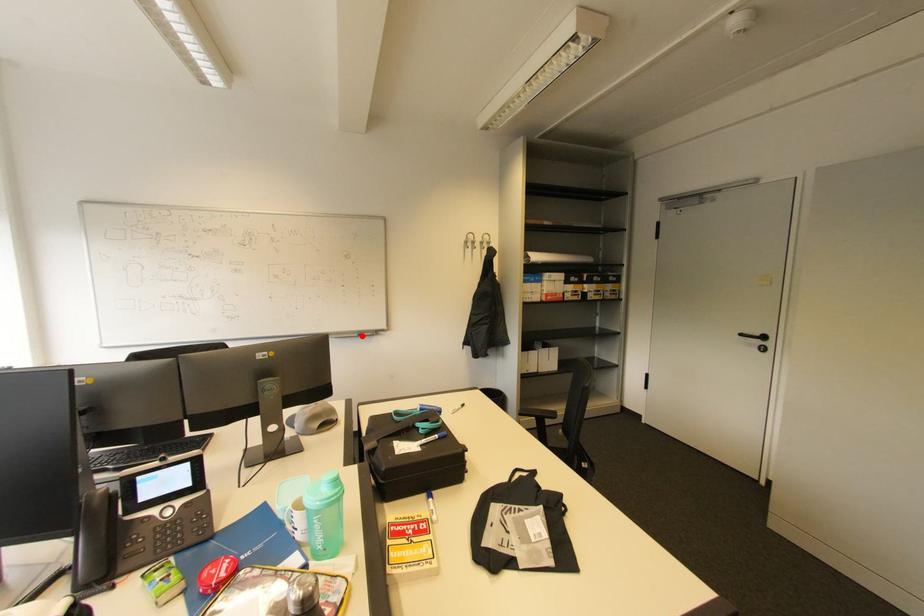
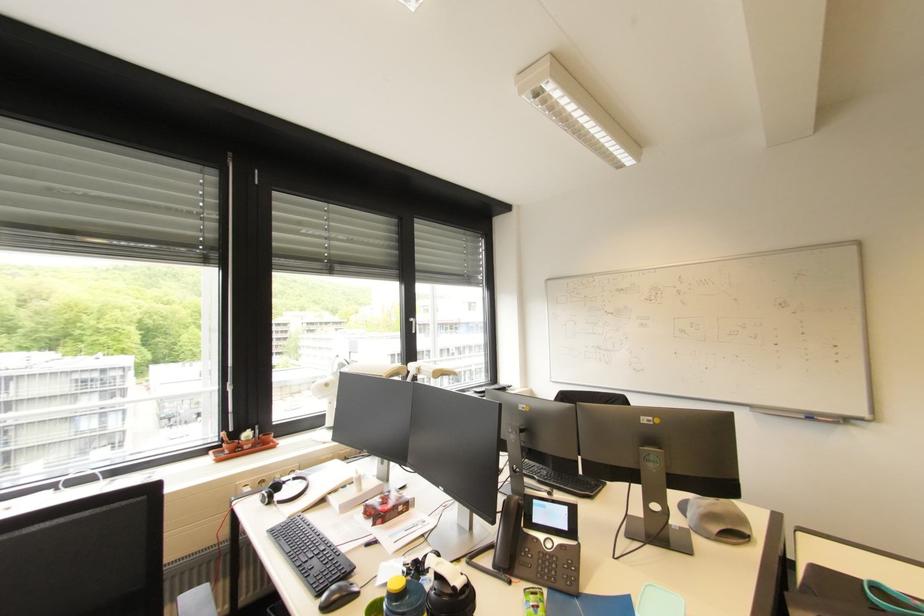
Question: I am providing you with two images of the same scene from different viewpoints. A red point is marked on the first image. Can you still see the location of the red point in image 2?

Choices:
 (A) Yes
 (B) No

Answer: (A)